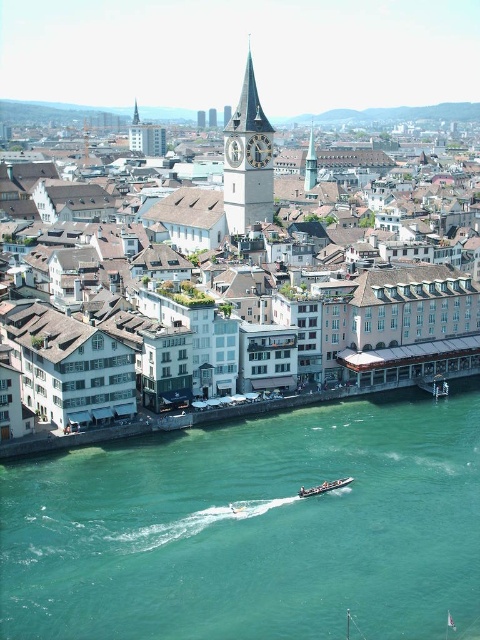
You are standing at the point marked by coordinates point [252,529] in the image. What do you see directly below you?

The point [252,529] corresponds to the teal glossy water at lower center, so you are directly above the teal glossy water at lower center.

You are a tourist standing at the base of the white textured building at center. You want to walk to the teal glossy water at lower center. Given that your average walking speed is 1.4 meters per second, how many seconds will it take you to reach the water?

The distance between the white textured building at center and the teal glossy water at lower center is 72.72 meters. At a walking speed of 1.4 meters per second, it will take approximately 72.72 divided by 1.4, which equals about 51.94 seconds. Rounding to the nearest whole number, it would take roughly 52 seconds to reach the teal glossy water at lower center.

You are a tourist standing on the riverbank and want to take a photo of the smooth stone clock tower at center. However, you notice the teal glossy water at lower center is blocking your view. Can you move to the right or left to avoid the water?

The teal glossy water at lower center is positioned on the left side of the smooth stone clock tower at center. To avoid the water, you should move to the right side of the clock tower.